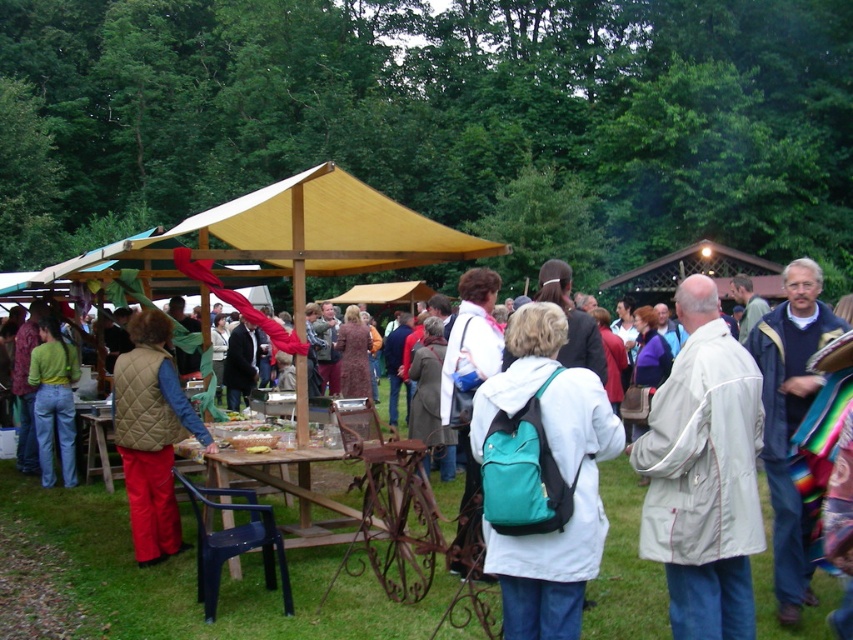
Who is more forward, (532, 330) or (688, 339)?

Point (532, 330)

Is teal fabric backpack at center shorter than light beige fabric jacket at center-right?

Yes, teal fabric backpack at center is shorter than light beige fabric jacket at center-right.

The width and height of the screenshot is (853, 640). I want to click on teal fabric backpack at center, so click(x=543, y=476).

Where is `teal fabric backpack at center`? teal fabric backpack at center is located at coordinates (543, 476).

Between teal fabric backpack at center and matte green sweater at left, which one appears on the right side from the viewer's perspective?

Positioned to the right is teal fabric backpack at center.

Measure the distance between teal fabric backpack at center and matte green sweater at left.

A distance of 22.49 feet exists between teal fabric backpack at center and matte green sweater at left.

What do you see at coordinates (543, 476) in the screenshot? Image resolution: width=853 pixels, height=640 pixels. I see `teal fabric backpack at center` at bounding box center [543, 476].

The image size is (853, 640). In order to click on teal fabric backpack at center in this screenshot , I will do point(543,476).

Does teal fabric backpack at center have a smaller size compared to quilted beige vest at center?

Correct, teal fabric backpack at center occupies less space than quilted beige vest at center.

Between teal fabric backpack at center and quilted beige vest at center, which one is positioned lower?

quilted beige vest at center

This screenshot has width=853, height=640. I want to click on teal fabric backpack at center, so click(543, 476).